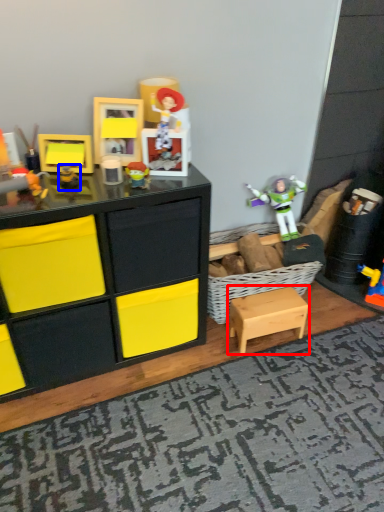
Question: Which point is closer to the camera, table (highlighted by a red box) or toy (highlighted by a blue box)?

Choices:
 (A) table
 (B) toy

Answer: (B)